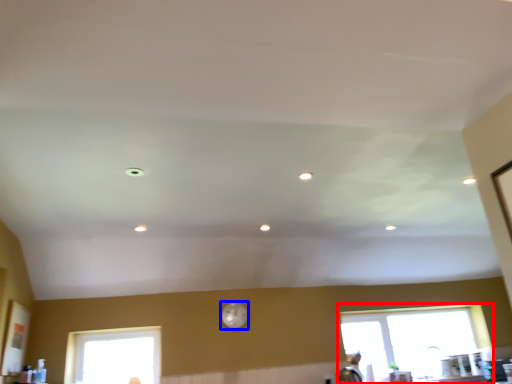
Question: Which object is closer to the camera taking this photo, window (highlighted by a red box) or clock (highlighted by a blue box)?

Choices:
 (A) window
 (B) clock

Answer: (B)